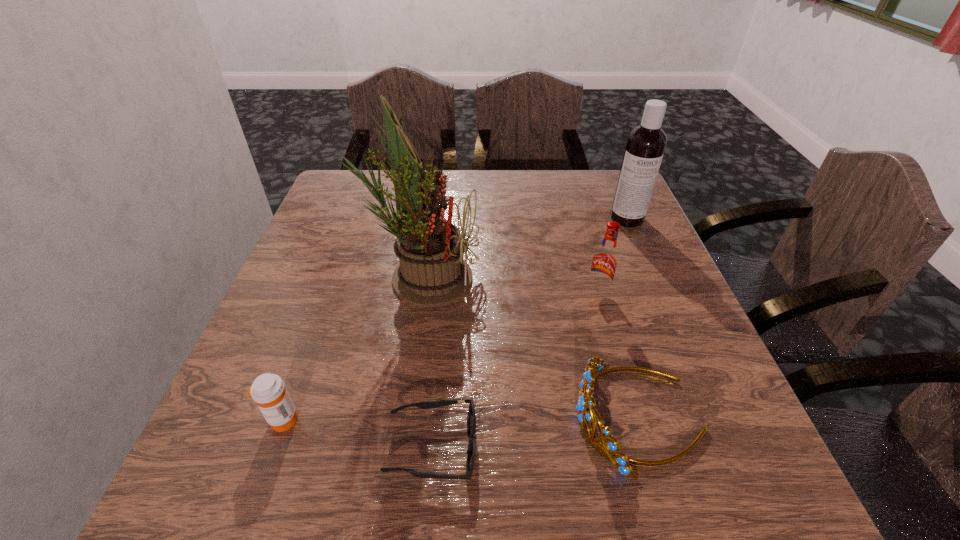
Image resolution: width=960 pixels, height=540 pixels. I want to click on dishwasher detergent that is at the right edge, so click(646, 143).

Identify the location of root beer located at the right edge. The width and height of the screenshot is (960, 540). (604, 263).

This screenshot has width=960, height=540. Find the location of `tiara situated at the right edge`. tiara situated at the right edge is located at coordinates (610, 449).

Locate an element on the screen. This screenshot has width=960, height=540. object situated at the far right corner is located at coordinates (646, 143).

Where is `object present at the near right corner`? This screenshot has height=540, width=960. object present at the near right corner is located at coordinates (610, 449).

Where is `free space at the far edge of the desktop`? The height and width of the screenshot is (540, 960). free space at the far edge of the desktop is located at coordinates 554,201.

The image size is (960, 540). What are the coordinates of `vacant space at the left edge of the desktop` in the screenshot? It's located at pyautogui.click(x=347, y=233).

Identify the location of free space at the right edge of the desktop. The width and height of the screenshot is (960, 540). (665, 350).

In order to click on free space at the far left corner of the desktop in this screenshot , I will do `click(348, 193)`.

Find the location of `vacant space at the far right corner of the desktop`. vacant space at the far right corner of the desktop is located at coordinates (612, 203).